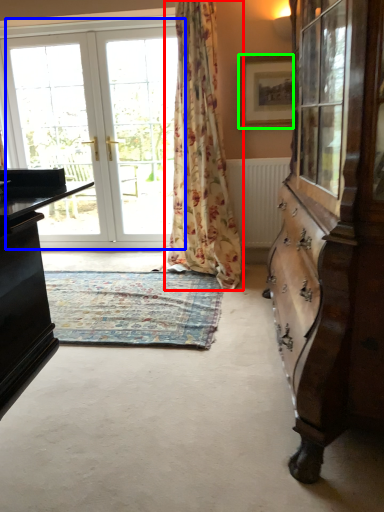
Question: Considering the real-world distances, which object is farthest from curtain (highlighted by a red box)? door (highlighted by a blue box) or picture frame (highlighted by a green box)?

Choices:
 (A) door
 (B) picture frame

Answer: (A)